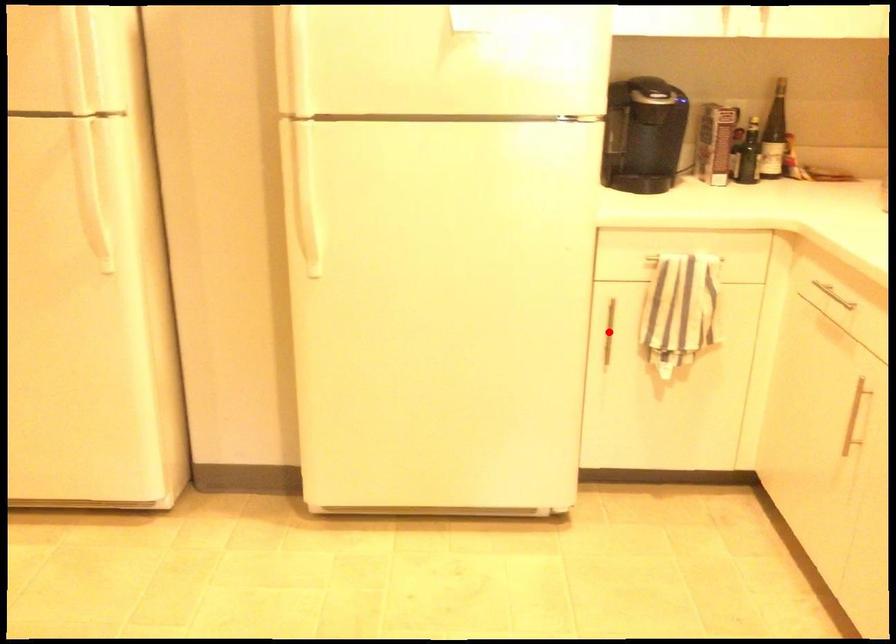
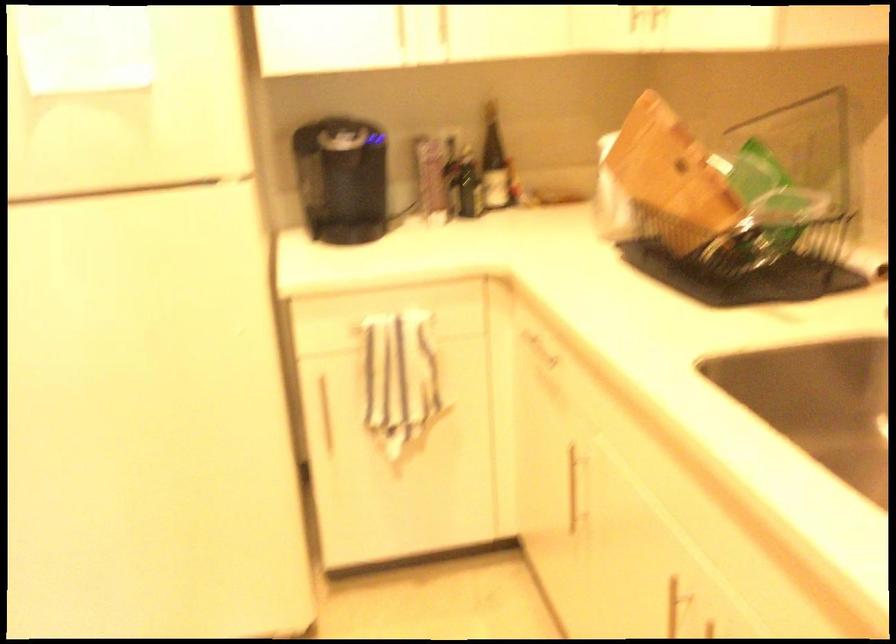
Where in the second image is the point corresponding to the highlighted location from the first image?

(323, 412)